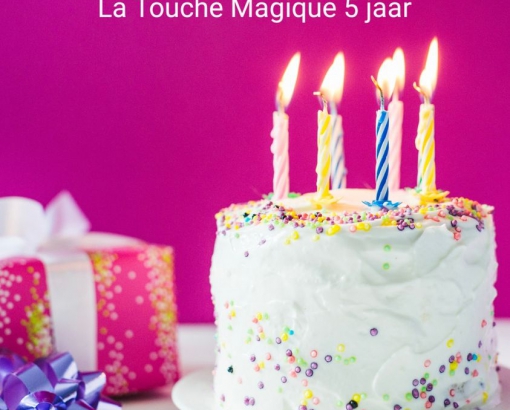
Where is `birthday candles`? The image size is (510, 410). birthday candles is located at coordinates (277, 163), (324, 176), (338, 152), (380, 177), (394, 157), (429, 152), (419, 172).